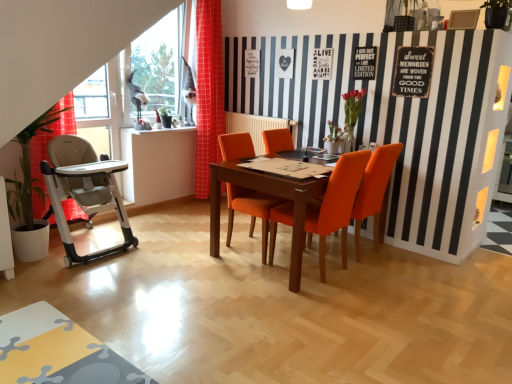
Image resolution: width=512 pixels, height=384 pixels. What are the coordinates of `free region on the left part of orange fabric chair at center, the 3th chair positioned from the right` in the screenshot? It's located at (191, 242).